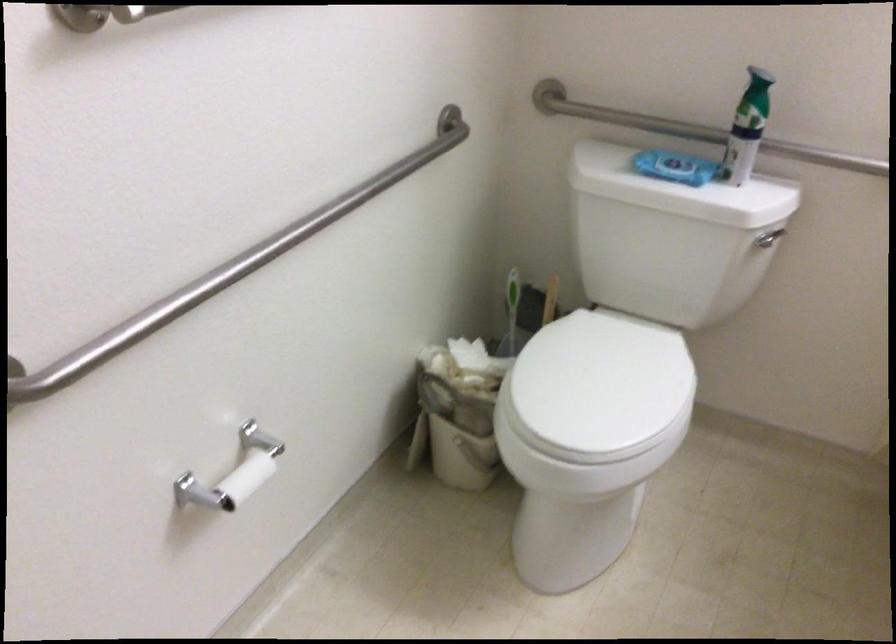
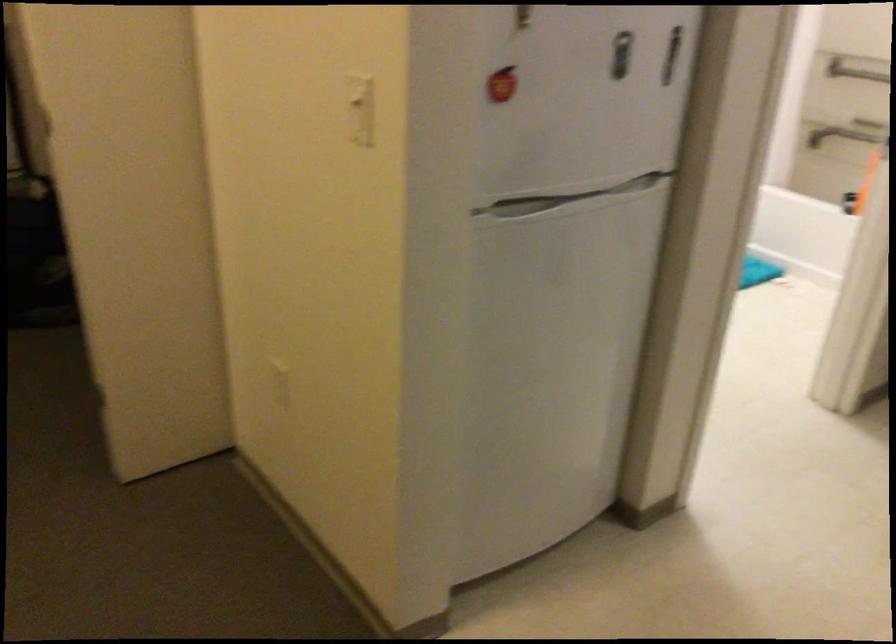
Question: I am providing you with two images of the same scene from different viewpoints. After the viewpoint changes to image2, which objects are now occluded?

Choices:
 (A) metal grab bar
 (B) refrigerator handle
 (C) small gray microwave
 (D) white light switch

Answer: (A)